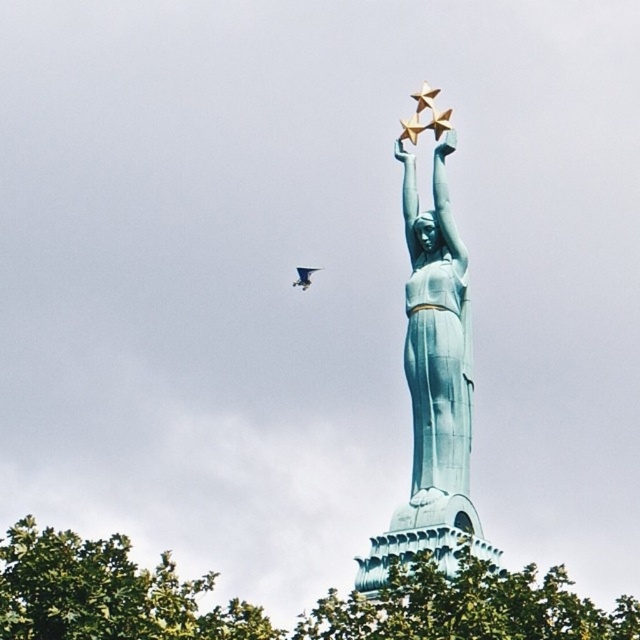
Question: Is green leafy tree at center thinner than green leafy tree at lower left?

Choices:
 (A) yes
 (B) no

Answer: (B)

Question: Is green leafy tree at center bigger than green leafy tree at lower left?

Choices:
 (A) yes
 (B) no

Answer: (B)

Question: Which point is farther from the camera taking this photo?

Choices:
 (A) (186, 634)
 (B) (518, 637)

Answer: (A)

Question: Is green leafy tree at center positioned behind green leafy tree at lower left?

Choices:
 (A) yes
 (B) no

Answer: (A)